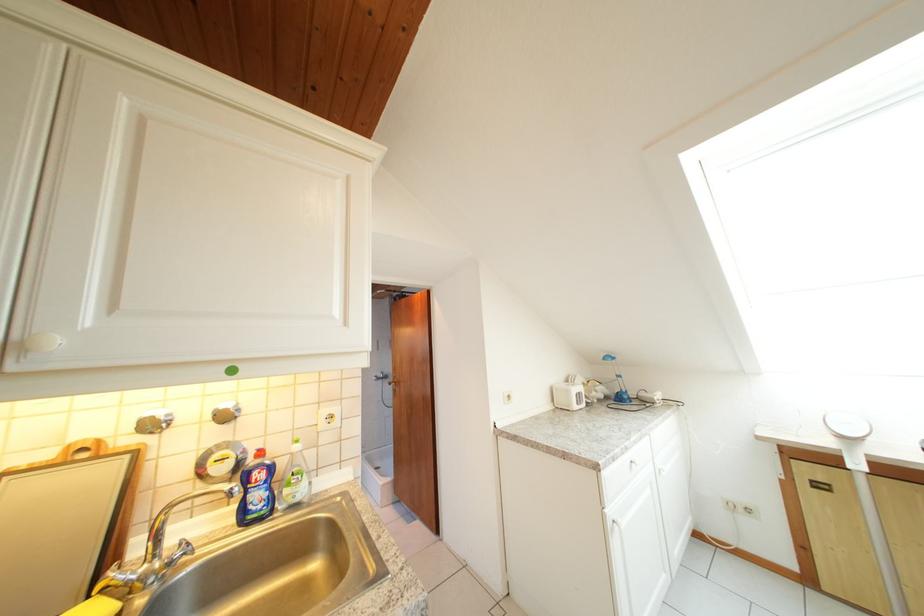
Where would you pull the brown door handle? Please return your answer as a coordinate pair (x, y).

(399, 387)